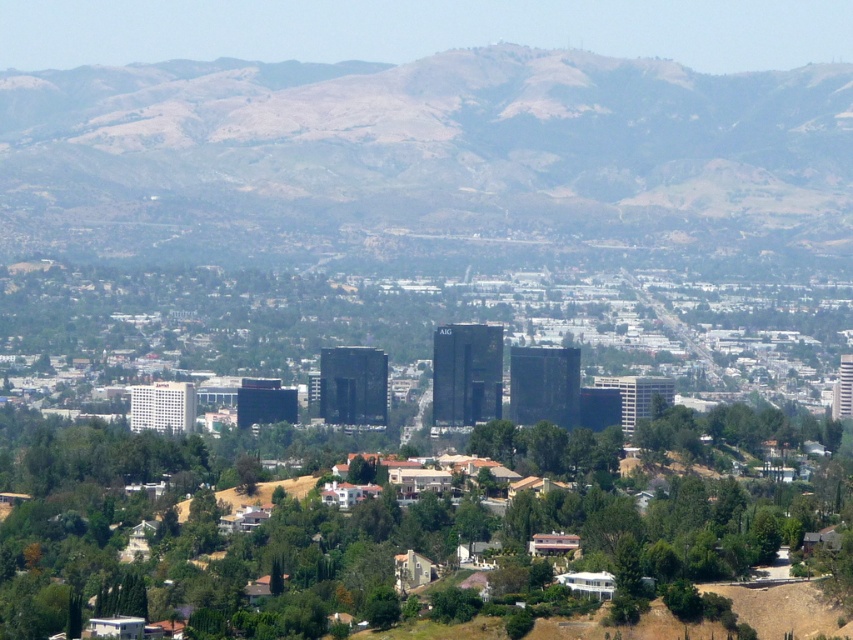
Question: Is brown/dry soil at center to the left of green leafy tree at center from the viewer's perspective?

Choices:
 (A) no
 (B) yes

Answer: (A)

Question: Among these points, which one is farthest from the camera?

Choices:
 (A) (296, 176)
 (B) (339, 595)

Answer: (B)

Question: Does brown/dry soil at center have a lesser width compared to green leafy tree at center?

Choices:
 (A) no
 (B) yes

Answer: (B)

Question: From the image, what is the correct spatial relationship of brown/dry soil at center in relation to green leafy tree at center?

Choices:
 (A) above
 (B) below

Answer: (A)